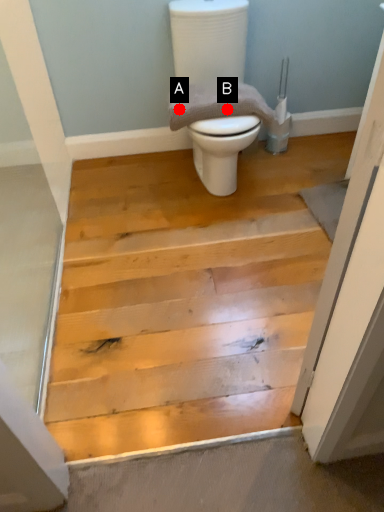
Question: Two points are circled on the image, labeled by A and B beside each circle. Among these points, which one is nearest to the camera?

Choices:
 (A) A is closer
 (B) B is closer

Answer: (A)